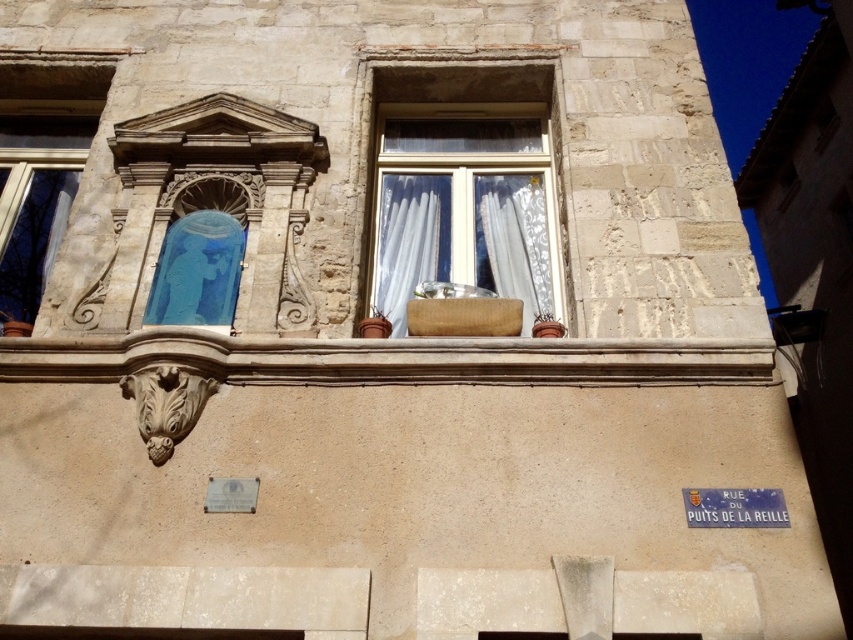
You are an architect designing a new building and want to ensure that the smooth stone ledge at center and the blue glass window at upper left are proportionate. Based on the image, which object has a greater width?

The smooth stone ledge at center has a greater width than the blue glass window at upper left according to the description.

From the picture: You are an interior designer assessing the windows of a historic building. You notice the white lace curtain at upper center and the white sheer curtain at center. Which curtain is shorter in height?

The white lace curtain at upper center is shorter than the white sheer curtain at center.

You are standing in front of the stone building and want to place a 1.5 meter tall statue on the smooth stone ledge at center. Will the statue fit on the ledge without falling off?

The smooth stone ledge at center is 17.15 meters away from the viewer, but the statue is only 1.5 meters tall. The distance does not affect the statue fitting on the ledge. However, without knowing the ledge width, we cannot determine if it will fit. Please provide more information about the ledge dimensions.